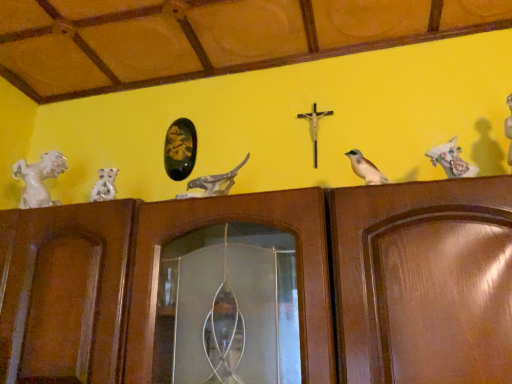
Describe the element at coordinates (314, 128) in the screenshot. The image size is (512, 384). I see `metallic gold crucifix at center` at that location.

You are a GUI agent. You are given a task and a screenshot of the screen. Output one action in this format:
    pyautogui.click(x=<x>, y=<y>)
    Task: Click on the matte gray stone bird at center, which is the 3th animal from left to right
    The image size is (512, 384).
    Given the screenshot: What is the action you would take?
    pyautogui.click(x=213, y=183)

Image resolution: width=512 pixels, height=384 pixels. What do you see at coordinates (105, 185) in the screenshot?
I see `white glossy statue at left, which is the third animal in right-to-left order` at bounding box center [105, 185].

Where is `white glossy horse at left, arranged as the first animal when viewed from the left`? white glossy horse at left, arranged as the first animal when viewed from the left is located at coordinates (39, 179).

Identify the location of brown wood door at center. (65, 293).

Considering the sizes of brown matte bird at center and matte gray stone bird at center, which is the 3th animal from left to right, in the image, is brown matte bird at center wider or thinner than matte gray stone bird at center, which is the 3th animal from left to right,?

Considering their sizes, brown matte bird at center looks slimmer than matte gray stone bird at center, which is the 3th animal from left to right.

Which is behind, brown matte bird at center or matte gray stone bird at center, the 2th animal when ordered from right to left?

matte gray stone bird at center, the 2th animal when ordered from right to left.

Find the location of `the 1st animal behind the brown matte bird at center`. the 1st animal behind the brown matte bird at center is located at coordinates (213, 183).

From the image's perspective, is brown matte bird at center located beneath matte gray stone bird at center, the 2th animal when ordered from right to left?

No.

From a real-world perspective, is white glossy horse at upper right, placed as the 1th animal when sorted from right to left, positioned over brown wood door at center based on gravity?

Yes, from a real-world perspective, white glossy horse at upper right, placed as the 1th animal when sorted from right to left, is on top of brown wood door at center.

From the image's perspective, is white glossy horse at upper right, placed as the 1th animal when sorted from right to left, beneath brown wood door at center?

Actually, white glossy horse at upper right, placed as the 1th animal when sorted from right to left, appears above brown wood door at center in the image.

Does white glossy horse at upper right, placed as the 1th animal when sorted from right to left, turn towards brown wood door at center?

No, white glossy horse at upper right, placed as the 1th animal when sorted from right to left, does not turn towards brown wood door at center.

Which object is wider, white glossy horse at upper right, placed as the 1th animal when sorted from right to left, or brown wood door at center?

brown wood door at center.

Can you confirm if brown wood door at center is taller than metallic gold crucifix at center?

Yes.

From a real-world perspective, is brown wood door at center physically below metallic gold crucifix at center?

Yes, from a real-world perspective, brown wood door at center is beneath metallic gold crucifix at center.

Considering the sizes of brown wood door at center and metallic gold crucifix at center in the image, is brown wood door at center bigger or smaller than metallic gold crucifix at center?

Clearly, brown wood door at center is larger in size than metallic gold crucifix at center.

Are white glossy horse at left, which is the fourth animal from right to left, and white glossy horse at upper right, placed as the 1th animal when sorted from right to left, located far from each other?

They are positioned close to each other.

From the image's perspective, which is above, white glossy horse at left, arranged as the first animal when viewed from the left, or white glossy horse at upper right, placed as the 1th animal when sorted from right to left?

white glossy horse at upper right, placed as the 1th animal when sorted from right to left, appears higher in the image.

Can you confirm if white glossy horse at left, arranged as the first animal when viewed from the left, is smaller than white glossy horse at upper right, the fourth animal in the left-to-right sequence?

Actually, white glossy horse at left, arranged as the first animal when viewed from the left, might be larger than white glossy horse at upper right, the fourth animal in the left-to-right sequence.

What's the angular difference between white glossy horse at left, arranged as the first animal when viewed from the left, and white glossy horse at upper right, placed as the 1th animal when sorted from right to left,'s facing directions?

0.00128 degrees separate the facing orientations of white glossy horse at left, arranged as the first animal when viewed from the left, and white glossy horse at upper right, placed as the 1th animal when sorted from right to left.

Locate an element on the screen. This screenshot has width=512, height=384. animal located in front of the matte gray stone bird at center, the 2th animal when ordered from right to left is located at coordinates (451, 160).

Which object is positioned more to the left, matte gray stone bird at center, the 2th animal when ordered from right to left, or white glossy horse at upper right, the fourth animal in the left-to-right sequence?

matte gray stone bird at center, the 2th animal when ordered from right to left, is more to the left.

Which of these two, matte gray stone bird at center, which is the 3th animal from left to right, or white glossy horse at upper right, placed as the 1th animal when sorted from right to left, is smaller?

white glossy horse at upper right, placed as the 1th animal when sorted from right to left.

Between matte gray stone bird at center, the 2th animal when ordered from right to left, and white glossy horse at upper right, placed as the 1th animal when sorted from right to left, which one has larger width?

With larger width is matte gray stone bird at center, the 2th animal when ordered from right to left.

This screenshot has height=384, width=512. In order to click on animal that is the 2nd object located in front of the white glossy horse at left, which is the fourth animal from right to left in this screenshot , I will do `click(213, 183)`.

Is matte gray stone bird at center, the 2th animal when ordered from right to left, located outside white glossy horse at left, arranged as the first animal when viewed from the left?

Yes, matte gray stone bird at center, the 2th animal when ordered from right to left, is outside of white glossy horse at left, arranged as the first animal when viewed from the left.

What's the angular difference between matte gray stone bird at center, the 2th animal when ordered from right to left, and white glossy horse at left, which is the fourth animal from right to left,'s facing directions?

The angle between the facing direction of matte gray stone bird at center, the 2th animal when ordered from right to left, and the facing direction of white glossy horse at left, which is the fourth animal from right to left, is 0.00032 degrees.

Can you confirm if matte gray stone bird at center, the 2th animal when ordered from right to left, is shorter than white glossy horse at left, arranged as the first animal when viewed from the left?

Yes.

Are white glossy statue at left, which is the third animal in right-to-left order, and brown matte bird at center located far from each other?

Actually, white glossy statue at left, which is the third animal in right-to-left order, and brown matte bird at center are a little close together.

From the image's perspective, is white glossy statue at left, the 2th animal positioned from the left, positioned above or below brown matte bird at center?

Clearly, from the image's perspective, white glossy statue at left, the 2th animal positioned from the left, is below brown matte bird at center.

Which is behind, point (106, 191) or point (367, 172)?

The point (106, 191) is farther.

From the picture: Is white glossy statue at left, the 2th animal positioned from the left, oriented towards brown matte bird at center?

No, white glossy statue at left, the 2th animal positioned from the left, is not facing towards brown matte bird at center.

Locate an element on the screen. animal that is the 1st one when counting backward from the brown matte bird at center is located at coordinates (213, 183).

Find the location of `door below the white glossy horse at upper right, the fourth animal in the left-to-right sequence (from the image's perspective)`. door below the white glossy horse at upper right, the fourth animal in the left-to-right sequence (from the image's perspective) is located at coordinates 65,293.

Looking at the image, which one is located further to matte gray stone bird at center, which is the 3th animal from left to right, metallic gold crucifix at center or brown wood door at center?

Based on the image, brown wood door at center appears to be further to matte gray stone bird at center, which is the 3th animal from left to right.

From the image, which object appears to be farther from white glossy statue at left, the 2th animal positioned from the left, brown wood door at center or brown matte bird at center?

brown matte bird at center is further to white glossy statue at left, the 2th animal positioned from the left.

When comparing their distances from metallic gold crucifix at center, does white glossy statue at left, which is the third animal in right-to-left order, or white glossy horse at upper right, the fourth animal in the left-to-right sequence, seem closer?

white glossy horse at upper right, the fourth animal in the left-to-right sequence, is positioned closer to the anchor metallic gold crucifix at center.

From the image, which object appears to be farther from matte gray stone bird at center, the 2th animal when ordered from right to left, white glossy statue at left, the 2th animal positioned from the left, or white glossy horse at left, arranged as the first animal when viewed from the left?

Based on the image, white glossy horse at left, arranged as the first animal when viewed from the left, appears to be further to matte gray stone bird at center, the 2th animal when ordered from right to left.

Estimate the real-world distances between objects in this image. Which object is further from white glossy horse at upper right, the fourth animal in the left-to-right sequence, brown matte bird at center or metallic gold crucifix at center?

metallic gold crucifix at center lies further to white glossy horse at upper right, the fourth animal in the left-to-right sequence, than the other object.

When comparing their distances from white glossy statue at left, which is the third animal in right-to-left order, does metallic gold crucifix at center or white glossy horse at left, which is the fourth animal from right to left, seem closer?

The object closer to white glossy statue at left, which is the third animal in right-to-left order, is white glossy horse at left, which is the fourth animal from right to left.

In the scene shown: From the image, which object appears to be nearer to brown matte bird at center, white glossy horse at upper right, placed as the 1th animal when sorted from right to left, or matte gray stone bird at center, the 2th animal when ordered from right to left?

Among the two, white glossy horse at upper right, placed as the 1th animal when sorted from right to left, is located nearer to brown matte bird at center.

When comparing their distances from gold leaf painting at center, does white glossy horse at left, which is the fourth animal from right to left, or metallic gold crucifix at center seem further?

metallic gold crucifix at center is positioned further to the anchor gold leaf painting at center.

I want to click on door located between white glossy horse at left, which is the fourth animal from right to left, and matte gray stone bird at center, the 2th animal when ordered from right to left, in the left-right direction, so click(x=65, y=293).

You are a GUI agent. You are given a task and a screenshot of the screen. Output one action in this format:
    pyautogui.click(x=<x>, y=<y>)
    Task: Click on the art situated between white glossy horse at left, arranged as the first animal when viewed from the left, and metallic gold crucifix at center from left to right
    
    Given the screenshot: What is the action you would take?
    pyautogui.click(x=180, y=149)

Identify the location of animal between gold leaf painting at center and metallic gold crucifix at center. pos(213,183).

Where is `art between white glossy statue at left, which is the third animal in right-to-left order, and brown matte bird at center from left to right`? art between white glossy statue at left, which is the third animal in right-to-left order, and brown matte bird at center from left to right is located at coordinates (180, 149).